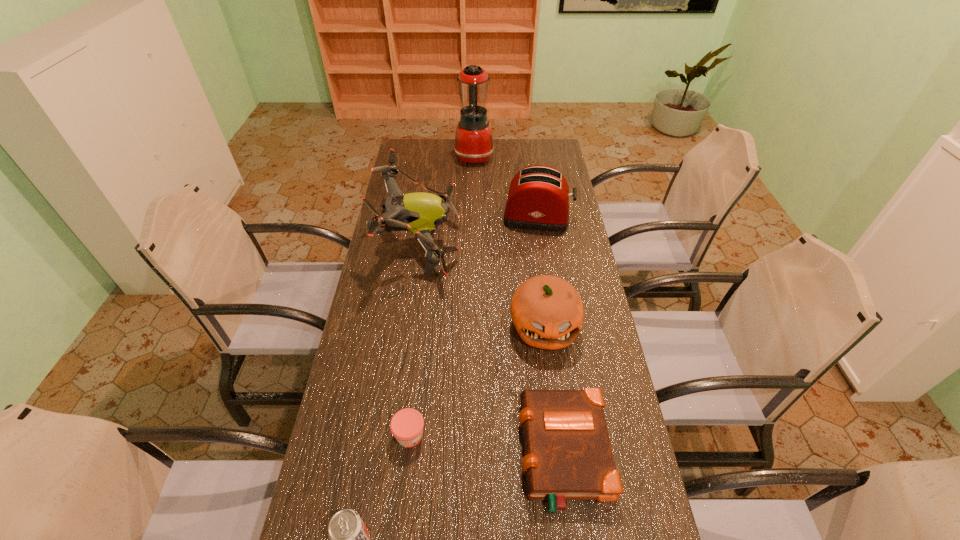
At what (x,y) coordinates should I click in order to perform the action: click on Bible present at the right edge. Please return your answer as a coordinate pair (x, y). Looking at the image, I should click on (567, 453).

Locate an element on the screen. The image size is (960, 540). vacant space at the left edge of the desktop is located at coordinates point(364,489).

The image size is (960, 540). Find the location of `free space at the right edge of the desktop`. free space at the right edge of the desktop is located at coordinates (609, 404).

Where is `free space at the far left corner of the desktop`? This screenshot has width=960, height=540. free space at the far left corner of the desktop is located at coordinates (412, 155).

Locate an element on the screen. vacant space that is in between the Bible and the sixth shortest object is located at coordinates coord(492,348).

At what (x,y) coordinates should I click in order to perform the action: click on unoccupied area between the tallest object and the toaster. Please return your answer as a coordinate pair (x, y). This screenshot has height=540, width=960. Looking at the image, I should click on (506, 186).

This screenshot has height=540, width=960. Identify the location of free point between the jam and the drone. (415, 339).

Identify which object is the sixth nearest to the fourth farthest object. Please provide its 2D coordinates. Your answer should be formatted as a tuple, i.e. [(x, y)], where the tuple contains the x and y coordinates of a point satisfying the conditions above.

[(474, 143)]

Identify which object is the sixth nearest to the third shortest object. Please provide its 2D coordinates. Your answer should be formatted as a tuple, i.e. [(x, y)], where the tuple contains the x and y coordinates of a point satisfying the conditions above.

[(474, 143)]